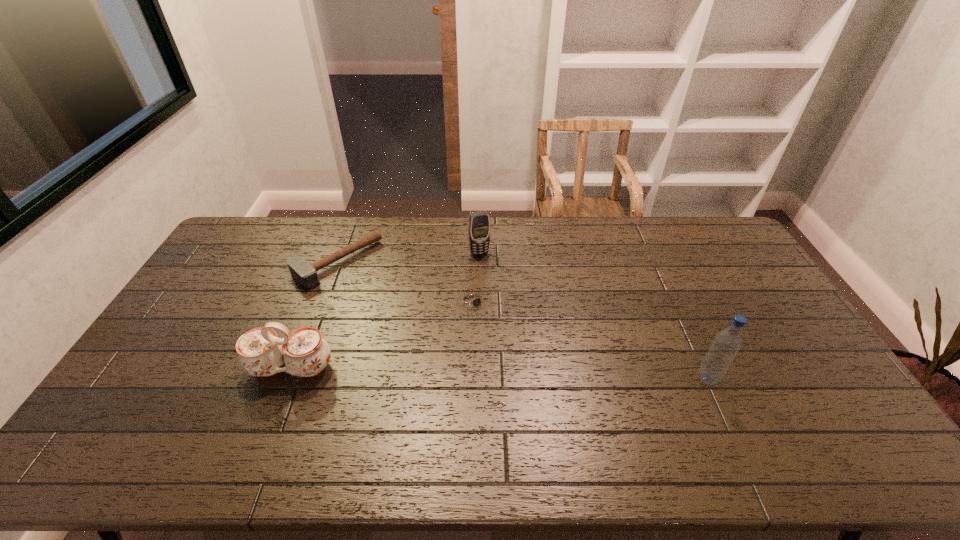
I want to click on chinaware, so click(x=305, y=353).

Locate an element on the screen. The image size is (960, 540). the rightmost object is located at coordinates (726, 344).

The height and width of the screenshot is (540, 960). What are the coordinates of `the tallest object` in the screenshot? It's located at (726, 344).

At what (x,y) coordinates should I click in order to perform the action: click on the shortest object. Please return your answer as a coordinate pair (x, y). The image size is (960, 540). Looking at the image, I should click on (473, 300).

Where is `hammer`? hammer is located at coordinates (305, 274).

I want to click on cellular telephone, so click(x=479, y=222).

Where is `free region located 0.340m on the left of the rightmost object`? The image size is (960, 540). free region located 0.340m on the left of the rightmost object is located at coordinates (572, 379).

Image resolution: width=960 pixels, height=540 pixels. In order to click on vacant space located 0.180m on the face of the shortest object in this screenshot , I will do `click(513, 353)`.

Locate an element on the screen. The height and width of the screenshot is (540, 960). free space located on the face of the shortest object is located at coordinates (557, 413).

This screenshot has height=540, width=960. Find the location of `free space located 0.390m on the face of the shortest object`. free space located 0.390m on the face of the shortest object is located at coordinates (555, 409).